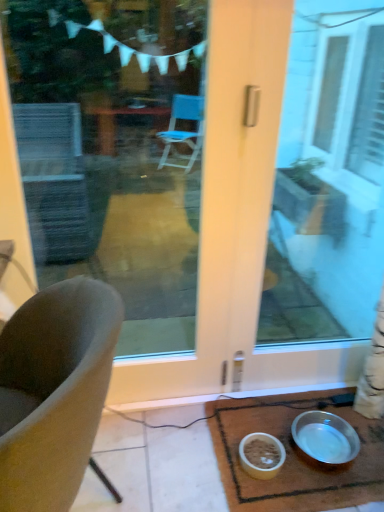
Locate an element on the screen. space that is in front of matte brown bowl at lower center, acting as the first bowl starting from the left is located at coordinates (263, 497).